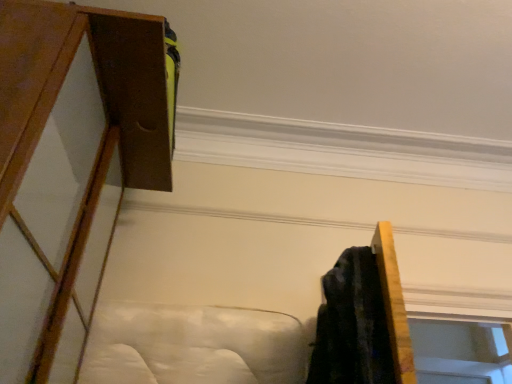
In order to click on wooden mirror at left in this screenshot , I will do `click(72, 166)`.

What do you see at coordinates (72, 166) in the screenshot? Image resolution: width=512 pixels, height=384 pixels. I see `wooden mirror at left` at bounding box center [72, 166].

The image size is (512, 384). What are the coordinates of `wooden mirror at left` in the screenshot? It's located at [x=72, y=166].